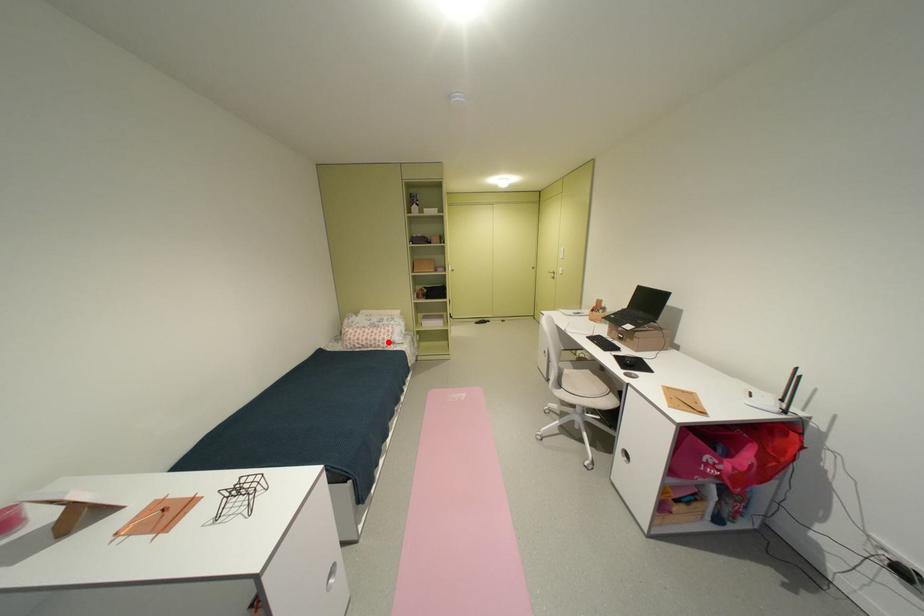
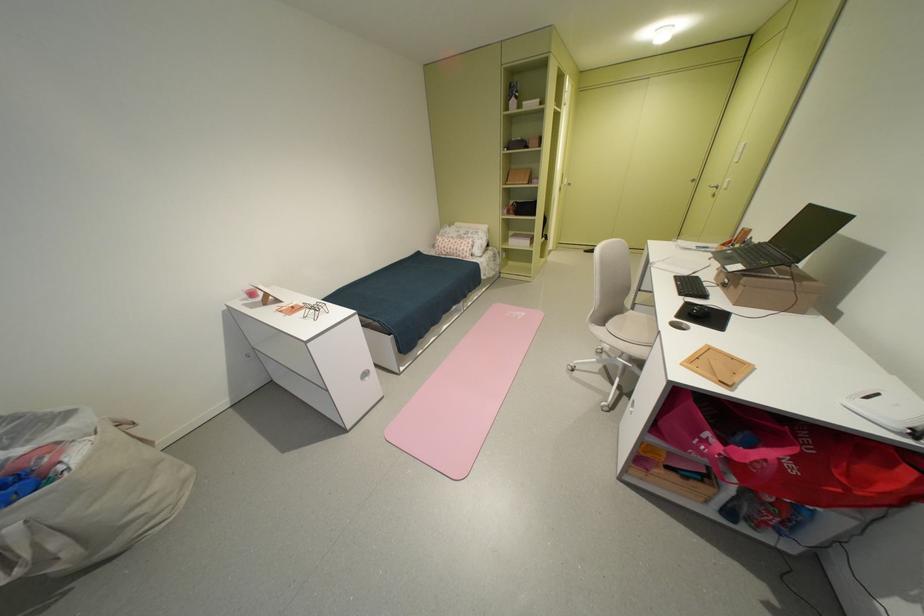
Question: I am providing you with two images of the same scene from different viewpoints. A red point is shown in image1. For the corresponding object point in image2, is it positioned nearer or farther from the camera?

Choices:
 (A) Nearer
 (B) Farther

Answer: (A)